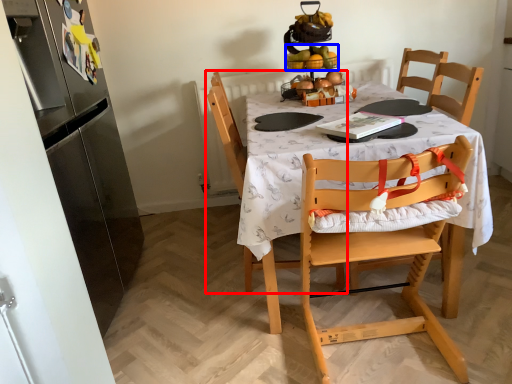
Question: Which object is further to the camera taking this photo, chair (highlighted by a red box) or fruit (highlighted by a blue box)?

Choices:
 (A) chair
 (B) fruit

Answer: (B)